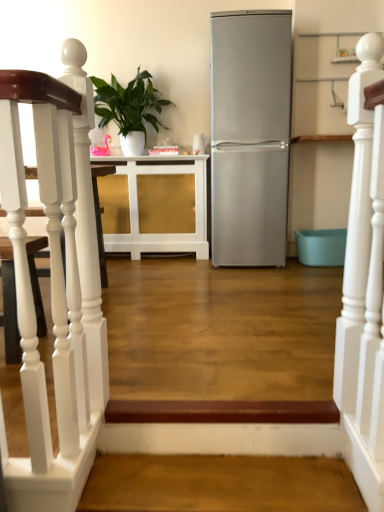
I want to click on unoccupied space behind white wooden railing at upper right, so click(302, 394).